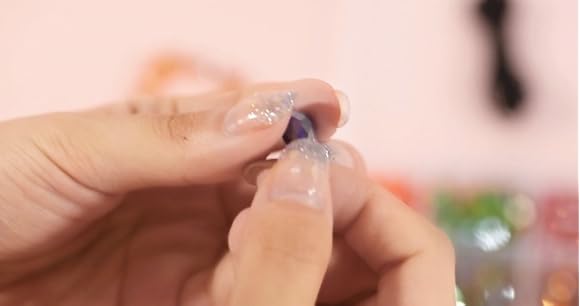
Locate an element on the screen. pink wall is located at coordinates (14, 30), (387, 33), (525, 145).